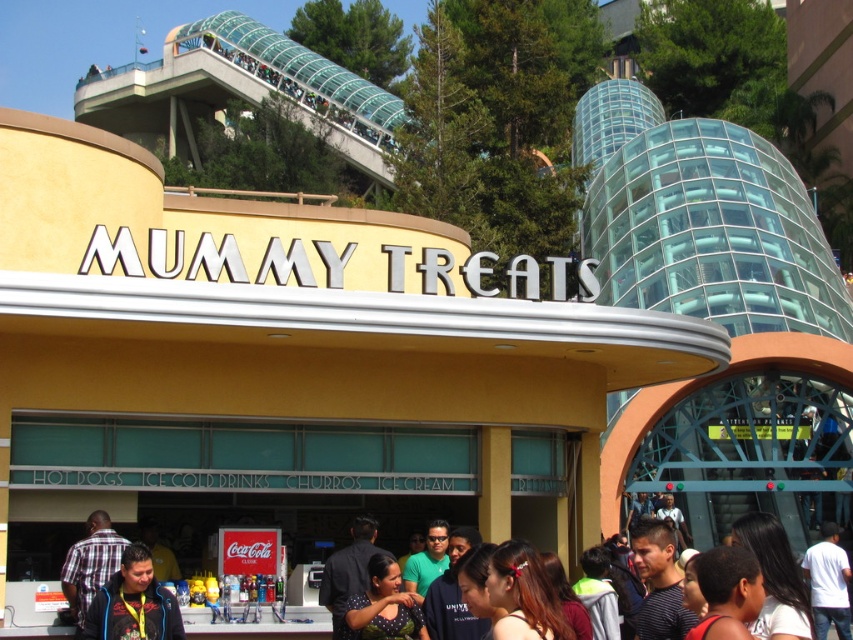
Question: Among these objects, which one is nearest to the camera?

Choices:
 (A) dark blue jacket at lower left
 (B) dark brown hair at center

Answer: (B)

Question: Which point is closer to the camera?

Choices:
 (A) (822, 636)
 (B) (132, 628)

Answer: (B)

Question: Can you confirm if dark brown hair at center is positioned above dark blue jacket at lower left?

Choices:
 (A) yes
 (B) no

Answer: (B)

Question: Is dark brown hair at center positioned before dark blue jacket at lower left?

Choices:
 (A) no
 (B) yes

Answer: (B)

Question: Where is dark brown hair at center located in relation to dark blue jacket at lower left in the image?

Choices:
 (A) below
 (B) above

Answer: (A)

Question: Which point appears farthest from the camera in this image?

Choices:
 (A) (798, 588)
 (B) (131, 563)

Answer: (B)